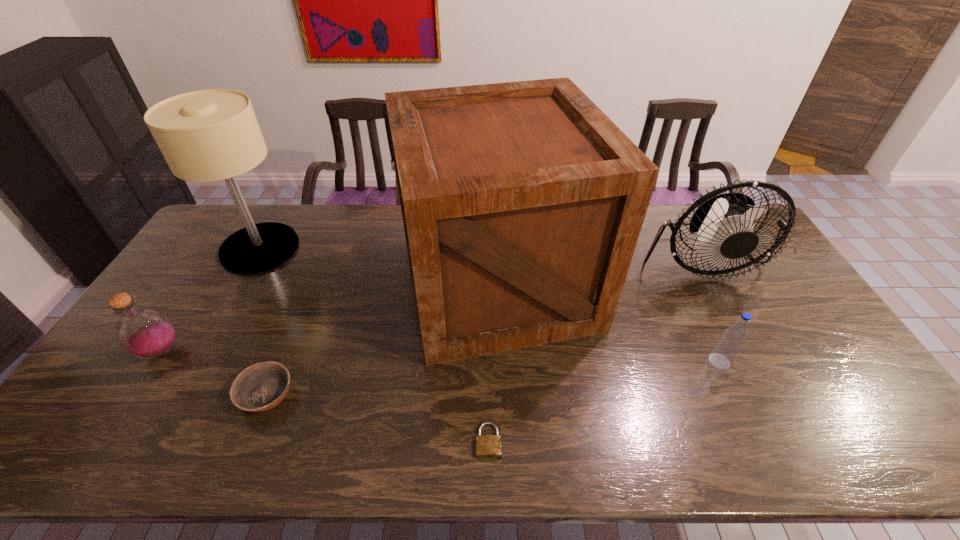
Where is `bottle present at the left edge`? The width and height of the screenshot is (960, 540). bottle present at the left edge is located at coordinates (145, 333).

Identify the location of object that is at the right edge. This screenshot has width=960, height=540. (721, 228).

Where is `object that is at the far left corner`? This screenshot has width=960, height=540. object that is at the far left corner is located at coordinates (208, 135).

Locate an element on the screen. The width and height of the screenshot is (960, 540). object that is at the far right corner is located at coordinates (721, 228).

Image resolution: width=960 pixels, height=540 pixels. I want to click on vacant space at the near edge of the desktop, so click(x=703, y=443).

Locate an element on the screen. This screenshot has height=540, width=960. free location at the left edge of the desktop is located at coordinates (140, 370).

Find the location of a particular element. free space at the right edge of the desktop is located at coordinates (848, 400).

In the image, there is a desktop. Identify the location of vacant space at the near right corner. This screenshot has width=960, height=540. (874, 449).

Locate an element on the screen. This screenshot has height=540, width=960. free point between the sixth tallest object and the box is located at coordinates (382, 339).

Where is `free space between the box and the nearest object`? The image size is (960, 540). free space between the box and the nearest object is located at coordinates (493, 362).